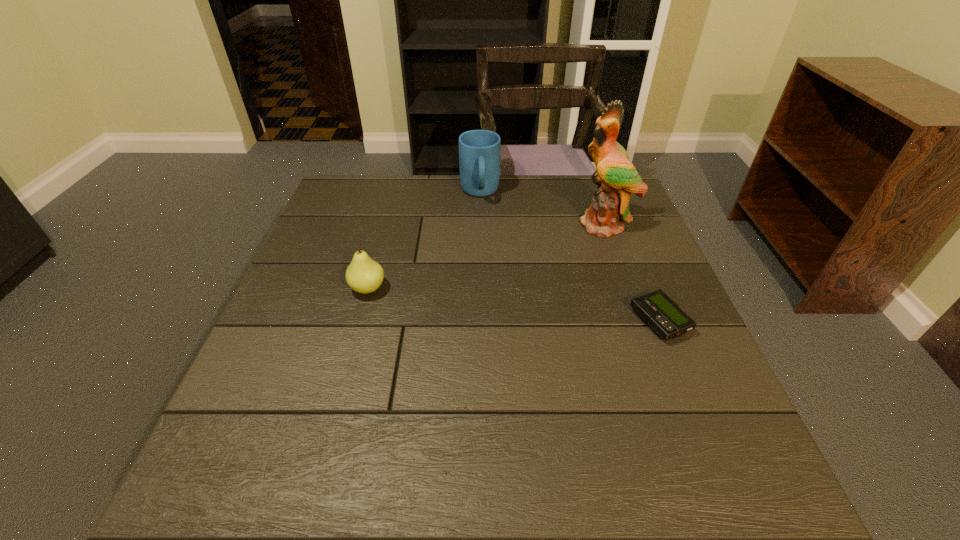
The width and height of the screenshot is (960, 540). What are the coordinates of `free space located on the side of the second object from left to right with the handle` in the screenshot? It's located at (489, 271).

At what (x,y) coordinates should I click in order to perform the action: click on blank area located on the side of the second object from left to right with the handle. Please return your answer as a coordinate pair (x, y). Looking at the image, I should click on (486, 244).

Find the location of `blank space located 0.140m on the front-facing side of the parrot`. blank space located 0.140m on the front-facing side of the parrot is located at coordinates (575, 265).

In order to click on vacant space situated 0.050m on the front-facing side of the parrot in this screenshot , I will do coord(588,246).

Where is `free space located 0.310m on the front-facing side of the parrot`? Image resolution: width=960 pixels, height=540 pixels. free space located 0.310m on the front-facing side of the parrot is located at coordinates (547, 306).

At what (x,y) coordinates should I click in order to perform the action: click on mug that is at the far edge. Please return your answer as a coordinate pair (x, y). Image resolution: width=960 pixels, height=540 pixels. Looking at the image, I should click on (479, 150).

Locate an element on the screen. Image resolution: width=960 pixels, height=540 pixels. parrot that is at the far edge is located at coordinates (616, 177).

Locate an element on the screen. The width and height of the screenshot is (960, 540). object present at the left edge is located at coordinates (364, 275).

You are a GUI agent. You are given a task and a screenshot of the screen. Output one action in this format:
    pyautogui.click(x=<x>, y=<y>)
    Task: Click on the beeper at the right edge
    
    Given the screenshot: What is the action you would take?
    pyautogui.click(x=658, y=310)

Where is `parrot situated at the right edge`? The height and width of the screenshot is (540, 960). parrot situated at the right edge is located at coordinates (616, 177).